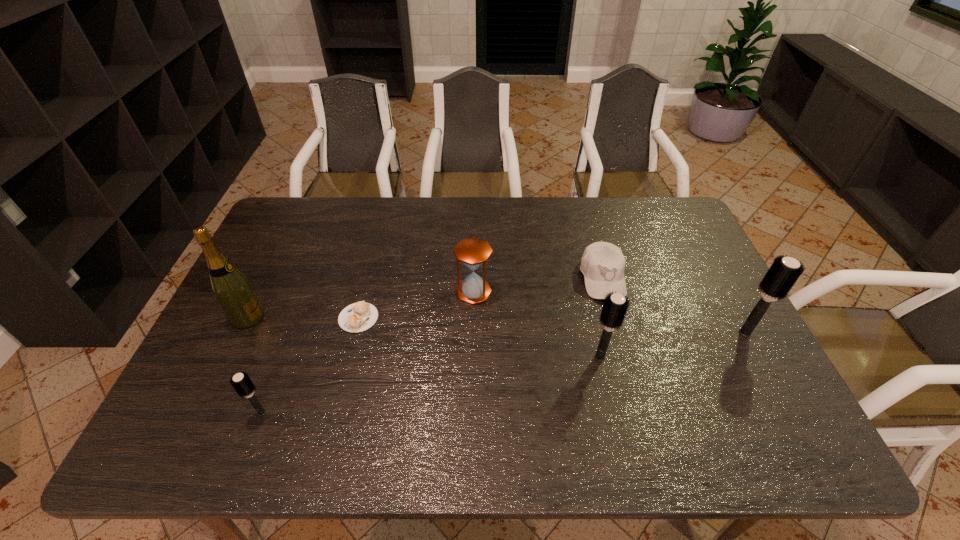
Locate an element on the screen. object located at the left edge is located at coordinates tap(231, 288).

This screenshot has height=540, width=960. I want to click on object that is at the right edge, so click(784, 272).

In the image, there is a desktop. What are the coordinates of `vacant space at the far edge` in the screenshot? It's located at (525, 216).

Locate an element on the screen. This screenshot has width=960, height=540. free space at the near edge is located at coordinates 702,389.

Locate an element on the screen. blank space at the right edge is located at coordinates (684, 269).

Where is `free spot at the far left corner of the desktop`? The width and height of the screenshot is (960, 540). free spot at the far left corner of the desktop is located at coordinates (315, 222).

The width and height of the screenshot is (960, 540). Find the location of `vacant space at the near left corner of the desktop`. vacant space at the near left corner of the desktop is located at coordinates (227, 409).

Identify the location of free space at the far right corner of the desktop. The image size is (960, 540). 662,224.

This screenshot has width=960, height=540. In order to click on free spot at the near right corner of the desktop in this screenshot , I will do `click(737, 394)`.

Locate an element on the screen. The image size is (960, 540). unoccupied area between the leftmost object and the third tallest object is located at coordinates (423, 337).